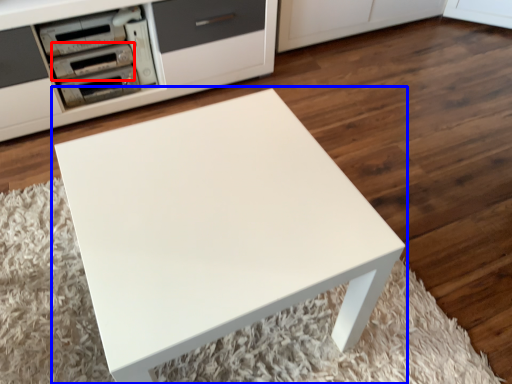
Question: Which object appears closest to the camera in this image, appliance (highlighted by a red box) or table (highlighted by a blue box)?

Choices:
 (A) appliance
 (B) table

Answer: (B)